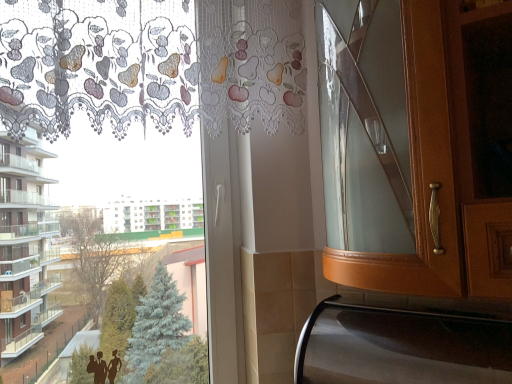
Question: From their relative heights in the image, would you say shiny metallic oven at lower right is taller or shorter than white lace curtain at upper left?

Choices:
 (A) tall
 (B) short

Answer: (B)

Question: From the image's perspective, is shiny metallic oven at lower right above or below white lace curtain at upper left?

Choices:
 (A) below
 (B) above

Answer: (A)

Question: Is shiny metallic oven at lower right wider or thinner than white lace curtain at upper left?

Choices:
 (A) thin
 (B) wide

Answer: (B)

Question: Considering the positions of point (144, 44) and point (440, 334), is point (144, 44) closer or farther from the camera than point (440, 334)?

Choices:
 (A) farther
 (B) closer

Answer: (A)

Question: Looking at the image, does white lace curtain at upper left seem bigger or smaller compared to shiny metallic oven at lower right?

Choices:
 (A) small
 (B) big

Answer: (B)

Question: From the image's perspective, is white lace curtain at upper left located above or below shiny metallic oven at lower right?

Choices:
 (A) below
 (B) above

Answer: (B)

Question: In terms of height, does white lace curtain at upper left look taller or shorter compared to shiny metallic oven at lower right?

Choices:
 (A) short
 (B) tall

Answer: (B)